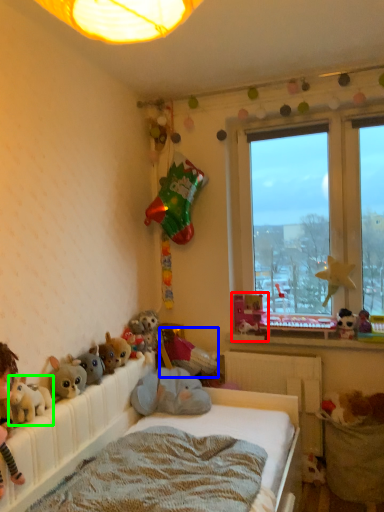
Question: Which object is positioned farthest from toy (highlighted by a red box)? Select from toy (highlighted by a blue box) and toy (highlighted by a green box).

Choices:
 (A) toy
 (B) toy

Answer: (B)